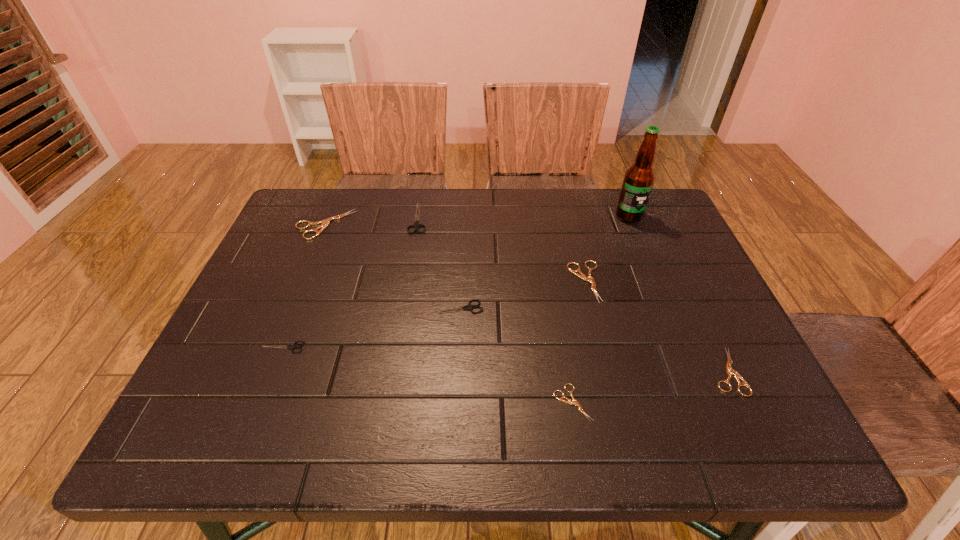
The image size is (960, 540). Find the location of `vacant region located 0.080m on the back of the second shears from right to left`. vacant region located 0.080m on the back of the second shears from right to left is located at coordinates (576, 242).

At what (x,y) coordinates should I click in order to perform the action: click on vacant space located on the left of the second smallest beige shears. Please return your answer as a coordinate pair (x, y). The image size is (960, 540). Looking at the image, I should click on (644, 371).

I want to click on vacant position located 0.200m on the back of the leftmost black shears, so click(309, 279).

This screenshot has height=540, width=960. In order to click on vacant space located on the right of the fourth object from right to left in this screenshot , I will do tap(625, 403).

Locate an element on the screen. The image size is (960, 540). beer bottle located at the far edge is located at coordinates (639, 178).

Where is `object located in the near edge section of the desktop`? This screenshot has height=540, width=960. object located in the near edge section of the desktop is located at coordinates (574, 402).

This screenshot has width=960, height=540. What are the coordinates of `beer bottle at the right edge` in the screenshot? It's located at (639, 178).

Find the location of a particular element. shears that is at the right edge is located at coordinates (730, 371).

Find the location of a particular element. object situated at the far left corner is located at coordinates (324, 223).

Where is `object that is at the far right corner`? object that is at the far right corner is located at coordinates (639, 178).